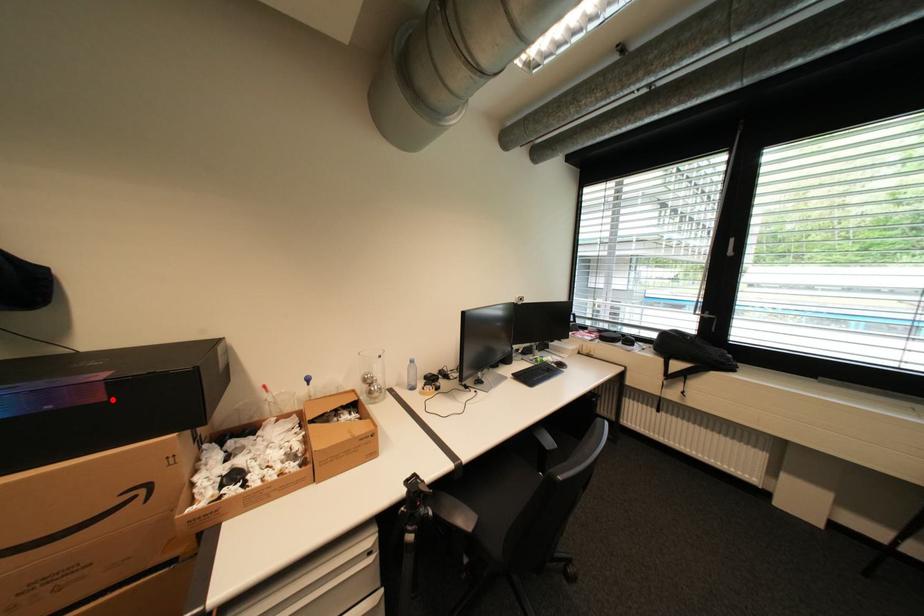
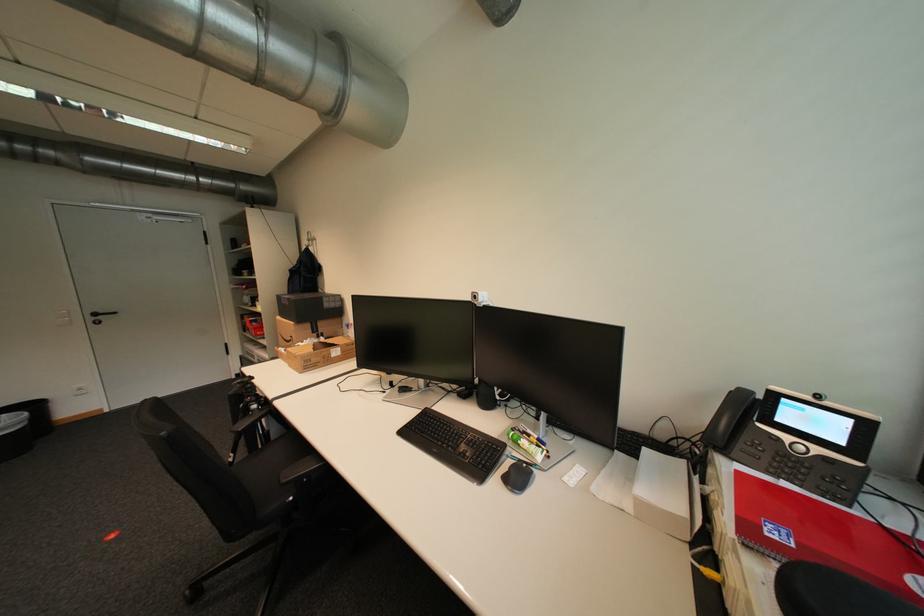
Find the pixel in the second image that matches the highlighted location in the first image.

(296, 305)